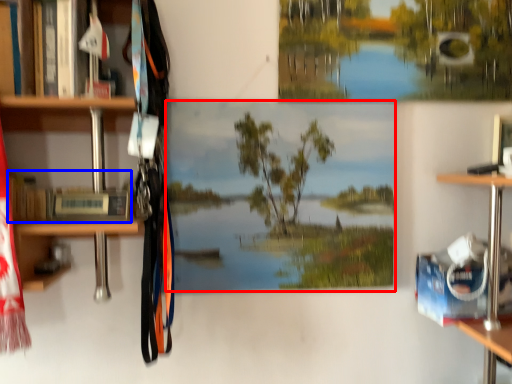
Question: Which point is closer to the camera, mural (highlighted by a red box) or book (highlighted by a blue box)?

Choices:
 (A) mural
 (B) book

Answer: (B)